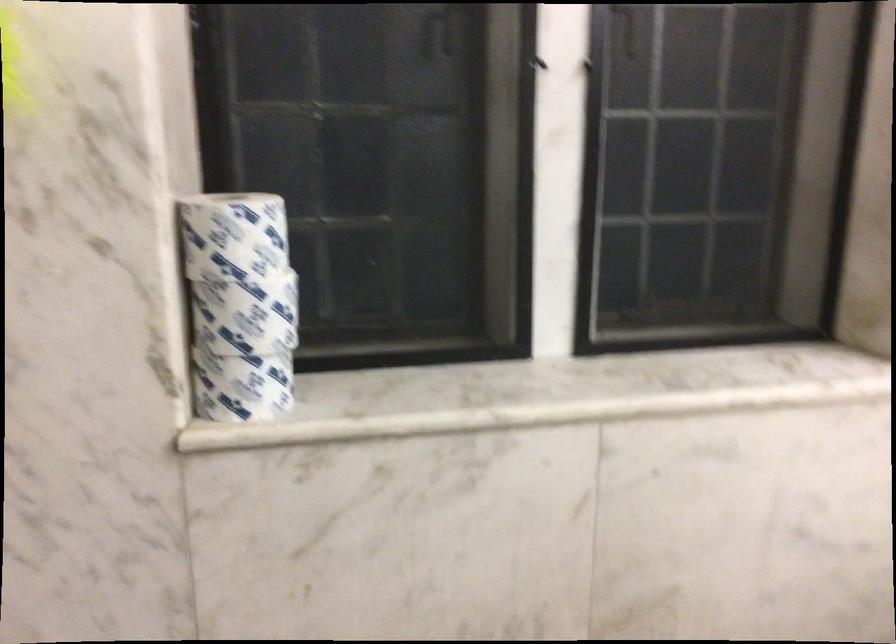
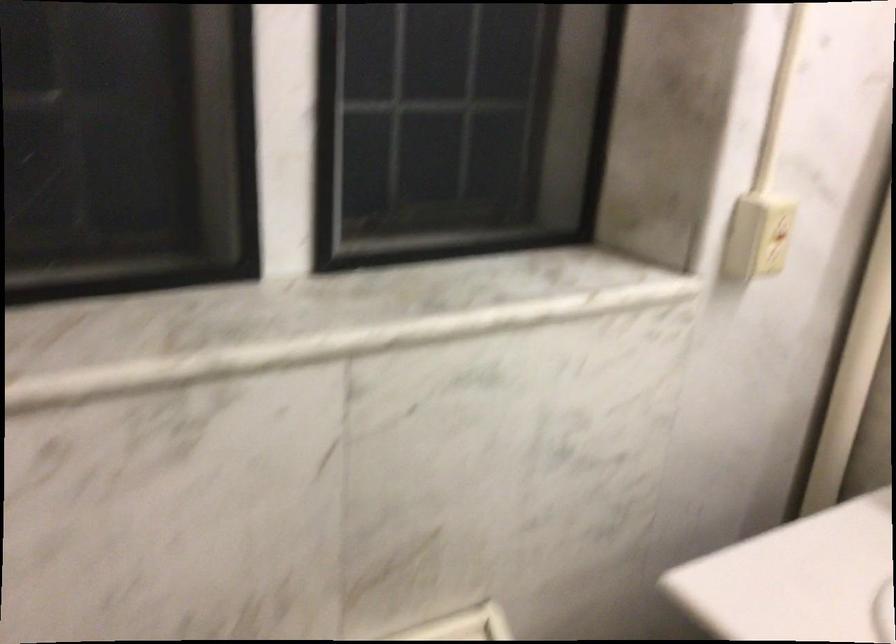
Question: The images are taken continuously from a first-person perspective. In which direction is your viewpoint rotating?

Choices:
 (A) Left
 (B) Right
 (C) Up
 (D) Down

Answer: (B)